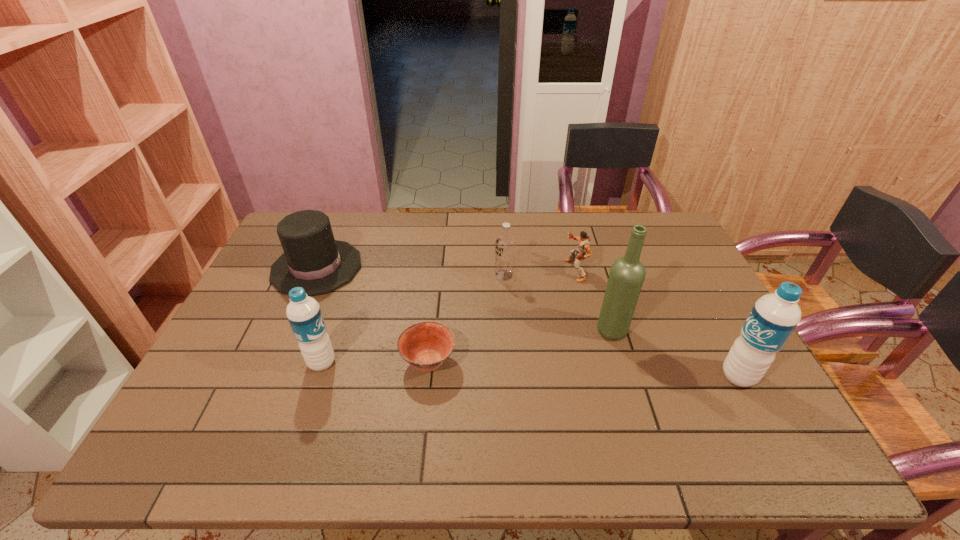
The height and width of the screenshot is (540, 960). In order to click on the shorter water bottle in this screenshot , I will do `click(303, 312)`.

Image resolution: width=960 pixels, height=540 pixels. Find the location of `the fifth shortest object`. the fifth shortest object is located at coordinates (303, 312).

This screenshot has height=540, width=960. I want to click on the taller water bottle, so click(x=773, y=318).

Identify the location of the right water bottle. (773, 318).

Find the location of a particular element. This screenshot has width=960, height=540. wine bottle is located at coordinates (627, 274).

You are a GUI agent. You are given a task and a screenshot of the screen. Output one action in this format:
    pyautogui.click(x=<x>, y=<y>)
    Task: Click on the dress hat
    Image resolution: width=960 pixels, height=540 pixels.
    Given the screenshot: What is the action you would take?
    pyautogui.click(x=312, y=259)

The image size is (960, 540). Identify the location of puncher. (583, 241).

This screenshot has height=540, width=960. In order to click on vodka in this screenshot , I will do `click(505, 243)`.

Find the location of a particular element. The width and height of the screenshot is (960, 540). the fifth object from right to left is located at coordinates (426, 345).

At what (x,y) coordinates should I click in order to perform the action: click on the shortest object. Please return your answer as a coordinate pair (x, y). The width and height of the screenshot is (960, 540). Looking at the image, I should click on (426, 345).